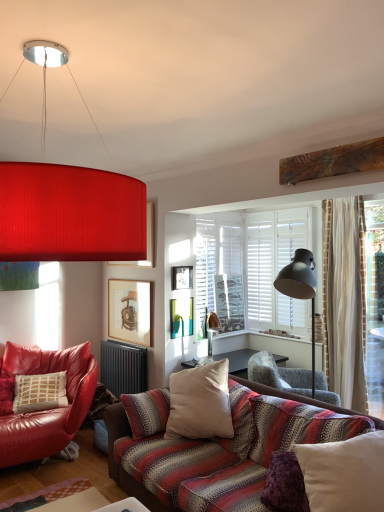
Question: From a real-world perspective, is black metallic radiator at lower center beneath matte red lampshade at upper center?

Choices:
 (A) no
 (B) yes

Answer: (B)

Question: Is black metallic radiator at lower center shorter than matte red lampshade at upper center?

Choices:
 (A) yes
 (B) no

Answer: (A)

Question: Considering the relative sizes of black metallic radiator at lower center and matte red lampshade at upper center in the image provided, is black metallic radiator at lower center taller than matte red lampshade at upper center?

Choices:
 (A) yes
 (B) no

Answer: (B)

Question: Can we say black metallic radiator at lower center lies outside matte red lampshade at upper center?

Choices:
 (A) yes
 (B) no

Answer: (A)

Question: Can you confirm if black metallic radiator at lower center is wider than matte red lampshade at upper center?

Choices:
 (A) no
 (B) yes

Answer: (A)

Question: Is matte red lampshade at upper center spatially inside white cotton cushion at center, or outside of it?

Choices:
 (A) outside
 (B) inside

Answer: (A)

Question: In terms of height, does matte red lampshade at upper center look taller or shorter compared to white cotton cushion at center?

Choices:
 (A) short
 (B) tall

Answer: (B)

Question: Is matte red lampshade at upper center to the left or to the right of white cotton cushion at center in the image?

Choices:
 (A) left
 (B) right

Answer: (A)

Question: Looking at the image, does matte red lampshade at upper center seem bigger or smaller compared to white cotton cushion at center?

Choices:
 (A) small
 (B) big

Answer: (B)

Question: From a real-world perspective, is white matte window screen at center positioned above or below matte wooden picture frame at upper center, placed as the first picture frame when sorted from top to bottom?

Choices:
 (A) above
 (B) below

Answer: (B)

Question: In terms of height, does white matte window screen at center look taller or shorter compared to matte wooden picture frame at upper center, placed as the first picture frame when sorted from top to bottom?

Choices:
 (A) tall
 (B) short

Answer: (A)

Question: Does point (198, 230) appear closer or farther from the camera than point (152, 233)?

Choices:
 (A) closer
 (B) farther

Answer: (B)

Question: In terms of width, does white matte window screen at center look wider or thinner when compared to matte wooden picture frame at upper center, placed as the first picture frame when sorted from top to bottom?

Choices:
 (A) thin
 (B) wide

Answer: (B)

Question: Is wooden picture frame at center, positioned as the 2th picture frame in top-to-bottom order, spatially inside wooden framed picture of chair at center, the third picture frame when ordered from top to bottom, or outside of it?

Choices:
 (A) outside
 (B) inside

Answer: (A)

Question: From a real-world perspective, is wooden picture frame at center, positioned as the 2th picture frame in top-to-bottom order, physically located above or below wooden framed picture of chair at center, arranged as the 1th picture frame when ordered from the bottom?

Choices:
 (A) below
 (B) above

Answer: (B)